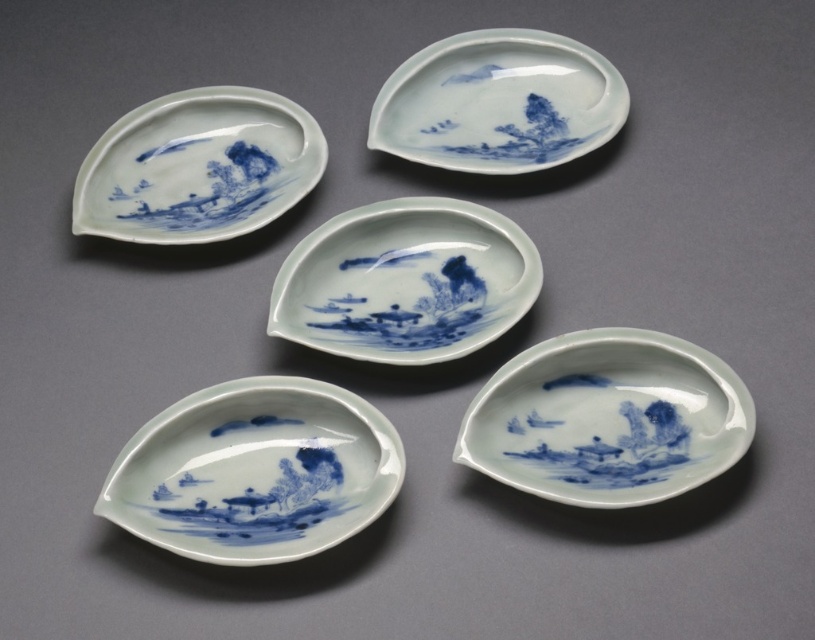
Question: Which point is farther to the camera?

Choices:
 (A) blue porcelain plate at upper center
 (B) blue porcelain plate at upper left

Answer: (A)

Question: Which point is closer to the camera?

Choices:
 (A) blue porcelain saucer at lower left
 (B) blue porcelain plate at upper center
 (C) blue porcelain plate at center
 (D) blue porcelain plate at upper left

Answer: (A)

Question: Which object appears closest to the camera in this image?

Choices:
 (A) blue porcelain plate at upper left
 (B) blue porcelain plate at center
 (C) blue porcelain saucer at lower left

Answer: (C)

Question: Is blue porcelain plate at center further to camera compared to blue porcelain plate at upper center?

Choices:
 (A) yes
 (B) no

Answer: (B)

Question: Is blue porcelain saucer at lower left to the right of blue porcelain plate at center from the viewer's perspective?

Choices:
 (A) yes
 (B) no

Answer: (B)

Question: Does blue porcelain plate at bottom right lie in front of blue porcelain plate at center?

Choices:
 (A) no
 (B) yes

Answer: (B)